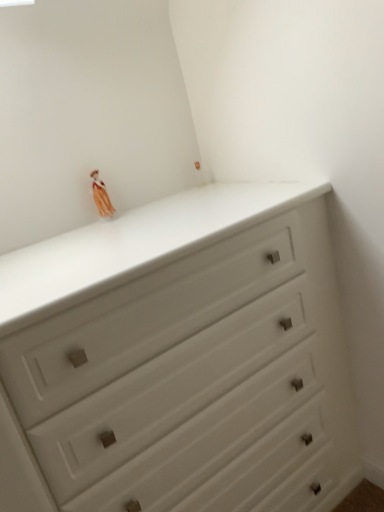
What do you see at coordinates (185, 355) in the screenshot?
I see `white matte chest of drawers at upper center` at bounding box center [185, 355].

Where is `white matte chest of drawers at upper center`? Image resolution: width=384 pixels, height=512 pixels. white matte chest of drawers at upper center is located at coordinates (185, 355).

Describe the element at coordinates (101, 196) in the screenshot. I see `matte orange fabric doll at upper left` at that location.

In order to click on matte orange fabric doll at upper left in this screenshot , I will do `click(101, 196)`.

Where is `white matte chest of drawers at upper center`? This screenshot has width=384, height=512. white matte chest of drawers at upper center is located at coordinates (185, 355).

Is matte orange fabric doll at upper left to the left or to the right of white matte chest of drawers at upper center in the image?

→ In the image, matte orange fabric doll at upper left appears on the left side of white matte chest of drawers at upper center.

In the image, is matte orange fabric doll at upper left positioned in front of or behind white matte chest of drawers at upper center?

matte orange fabric doll at upper left is positioned farther from the viewer than white matte chest of drawers at upper center.

Is point (100, 185) closer or farther from the camera than point (245, 327)?

Point (100, 185).

From the image's perspective, which one is positioned lower, matte orange fabric doll at upper left or white matte chest of drawers at upper center?

white matte chest of drawers at upper center, from the image's perspective.

From a real-world perspective, between matte orange fabric doll at upper left and white matte chest of drawers at upper center, who is vertically lower?

In real-world perspective, white matte chest of drawers at upper center is lower.

In terms of width, does matte orange fabric doll at upper left look wider or thinner when compared to white matte chest of drawers at upper center?

In the image, matte orange fabric doll at upper left appears to be more narrow than white matte chest of drawers at upper center.

Based on the photo, who is taller, matte orange fabric doll at upper left or white matte chest of drawers at upper center?

white matte chest of drawers at upper center.

Can you confirm if matte orange fabric doll at upper left is smaller than white matte chest of drawers at upper center?

Correct, matte orange fabric doll at upper left occupies less space than white matte chest of drawers at upper center.

Is matte orange fabric doll at upper left situated inside white matte chest of drawers at upper center or outside?

matte orange fabric doll at upper left is not enclosed by white matte chest of drawers at upper center.

Would you consider matte orange fabric doll at upper left to be distant from white matte chest of drawers at upper center?

Actually, matte orange fabric doll at upper left and white matte chest of drawers at upper center are a little close together.

Is matte orange fabric doll at upper left oriented away from white matte chest of drawers at upper center?

No, matte orange fabric doll at upper left is not facing away from white matte chest of drawers at upper center.

What's the angular difference between matte orange fabric doll at upper left and white matte chest of drawers at upper center's facing directions?

There is a 0.114-degree angle between the facing directions of matte orange fabric doll at upper left and white matte chest of drawers at upper center.

Could you measure the distance between matte orange fabric doll at upper left and white matte chest of drawers at upper center?

They are 29.27 inches apart.

The image size is (384, 512). In the image, there is a matte orange fabric doll at upper left. Identify the location of the chest of drawers below it (from a real-world perspective). (185, 355).

Considering the relative positions of white matte chest of drawers at upper center and matte orange fabric doll at upper left in the image provided, is white matte chest of drawers at upper center to the left of matte orange fabric doll at upper left from the viewer's perspective?

Incorrect, white matte chest of drawers at upper center is not on the left side of matte orange fabric doll at upper left.

In the image, is white matte chest of drawers at upper center positioned in front of or behind matte orange fabric doll at upper left?

Answer: Visually, white matte chest of drawers at upper center is located in front of matte orange fabric doll at upper left.

Between point (61, 469) and point (104, 201), which one is positioned behind?

The point (104, 201) is behind.

From the image's perspective, which is above, white matte chest of drawers at upper center or matte orange fabric doll at upper left?

matte orange fabric doll at upper left.

From a real-world perspective, is white matte chest of drawers at upper center under matte orange fabric doll at upper left?

Yes, from a real-world perspective, white matte chest of drawers at upper center is beneath matte orange fabric doll at upper left.

Which of these two, white matte chest of drawers at upper center or matte orange fabric doll at upper left, is wider?

Wider between the two is white matte chest of drawers at upper center.

From their relative heights in the image, would you say white matte chest of drawers at upper center is taller or shorter than matte orange fabric doll at upper left?

Considering their sizes, white matte chest of drawers at upper center has more height than matte orange fabric doll at upper left.

Who is bigger, white matte chest of drawers at upper center or matte orange fabric doll at upper left?

With larger size is white matte chest of drawers at upper center.

Is matte orange fabric doll at upper left located within white matte chest of drawers at upper center?

No.

Is white matte chest of drawers at upper center touching matte orange fabric doll at upper left?

No, white matte chest of drawers at upper center is not in contact with matte orange fabric doll at upper left.

Is matte orange fabric doll at upper left at the back of white matte chest of drawers at upper center?

white matte chest of drawers at upper center is not turned away from matte orange fabric doll at upper left.

Find the location of a particular element. The width and height of the screenshot is (384, 512). chest of drawers below the matte orange fabric doll at upper left (from a real-world perspective) is located at coordinates (185, 355).

Find the location of a particular element. The image size is (384, 512). chest of drawers below the matte orange fabric doll at upper left (from the image's perspective) is located at coordinates (185, 355).

Where is `miniature above the white matte chest of drawers at upper center (from a real-world perspective)`? The width and height of the screenshot is (384, 512). miniature above the white matte chest of drawers at upper center (from a real-world perspective) is located at coordinates (101, 196).